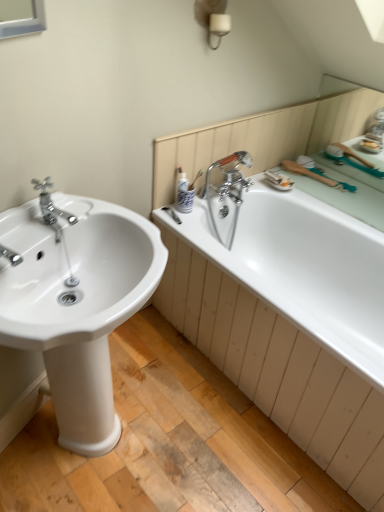
This screenshot has width=384, height=512. In order to click on vacant space underneath white glossy sink at left (from a real-world perspective) in this screenshot , I will do pos(111,446).